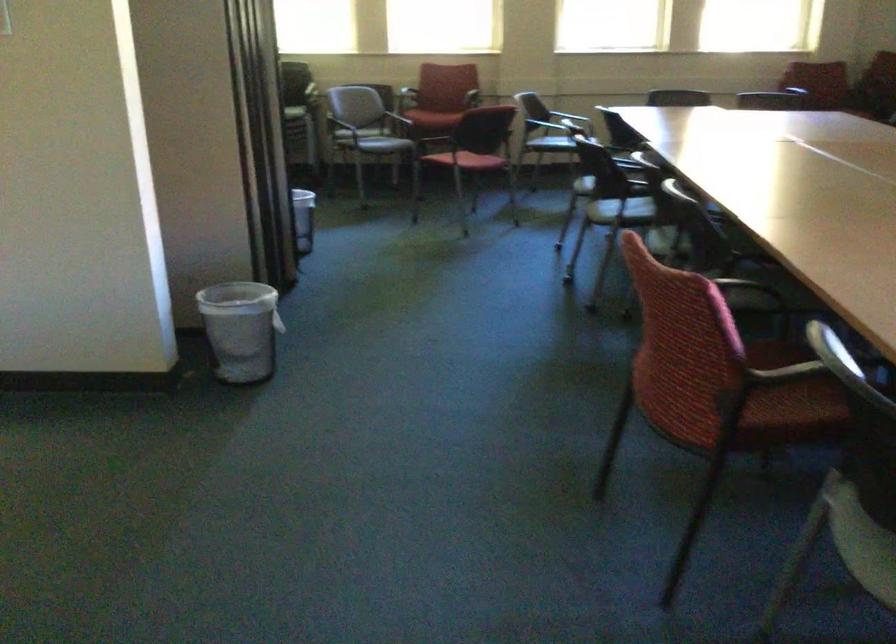
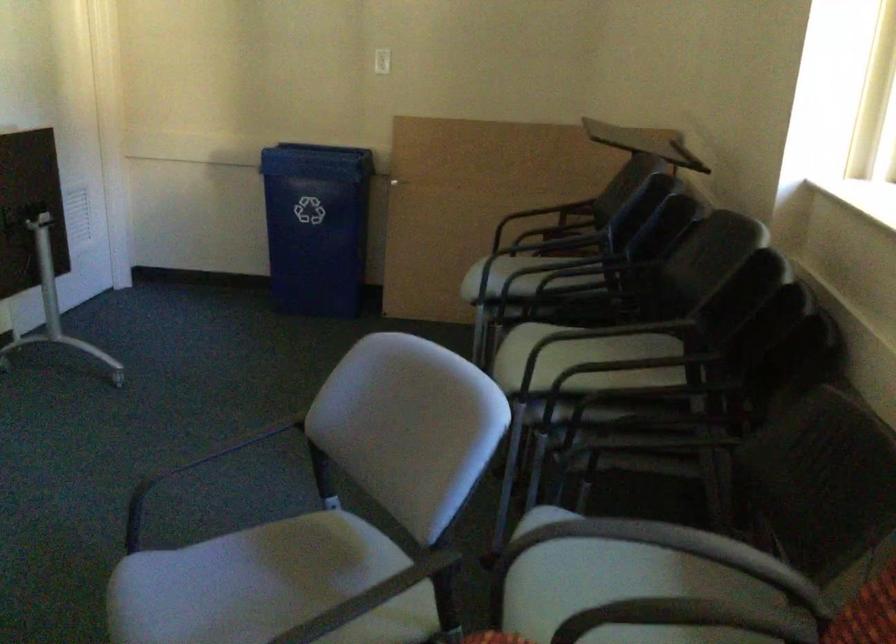
Where in the second image is the point corresponding to (x=363, y=124) from the first image?

(230, 446)